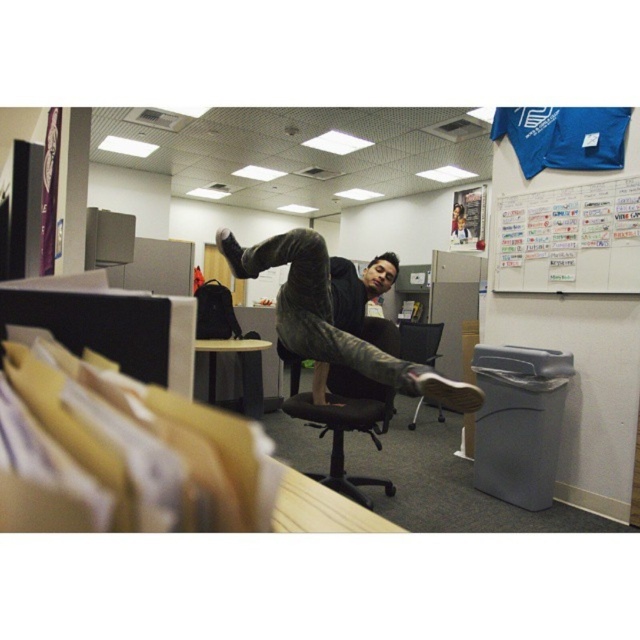
Question: Does whiteboard at upper right appear over dark gray jeans at center?

Choices:
 (A) no
 (B) yes

Answer: (B)

Question: Does black fabric swivel chair at center appear over black mesh office chair at center?

Choices:
 (A) no
 (B) yes

Answer: (A)

Question: Which object is closer to the camera taking this photo?

Choices:
 (A) dark gray jeans at center
 (B) black mesh office chair at center

Answer: (A)

Question: Does whiteboard at upper right appear on the left side of wooden table at center?

Choices:
 (A) yes
 (B) no

Answer: (B)

Question: Which object is the closest to the black fabric swivel chair at center?

Choices:
 (A) wooden table at center
 (B) black mesh office chair at center
 (C) dark gray jeans at center
 (D) whiteboard at upper right

Answer: (C)

Question: Which point is closer to the camera?

Choices:
 (A) dark gray jeans at center
 (B) whiteboard at upper right
 (C) black fabric swivel chair at center

Answer: (A)